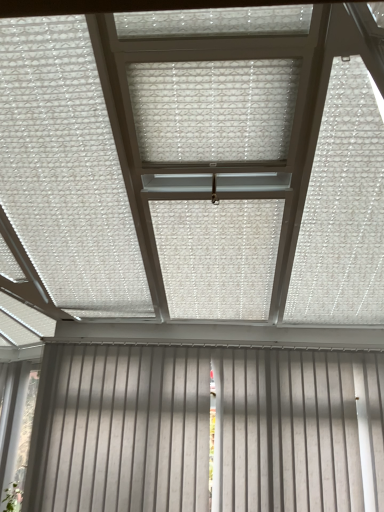
Question: Can you confirm if translucent plastic blind at center is thinner than white matte blinds at lower center?

Choices:
 (A) yes
 (B) no

Answer: (B)

Question: Is translucent plastic blind at center oriented away from white matte blinds at lower center?

Choices:
 (A) yes
 (B) no

Answer: (B)

Question: Is the depth of translucent plastic blind at center less than that of white matte blinds at lower center?

Choices:
 (A) no
 (B) yes

Answer: (B)

Question: Can you confirm if translucent plastic blind at center is smaller than white matte blinds at lower center?

Choices:
 (A) yes
 (B) no

Answer: (A)

Question: From the image's perspective, does translucent plastic blind at center appear higher than white matte blinds at lower center?

Choices:
 (A) no
 (B) yes

Answer: (B)

Question: Is translucent plastic blind at center aimed at white matte blinds at lower center?

Choices:
 (A) no
 (B) yes

Answer: (A)

Question: Considering the relative sizes of white matte blinds at lower center and translucent plastic blind at center in the image provided, is white matte blinds at lower center shorter than translucent plastic blind at center?

Choices:
 (A) no
 (B) yes

Answer: (A)

Question: Is white matte blinds at lower center not within translucent plastic blind at center?

Choices:
 (A) yes
 (B) no

Answer: (A)

Question: Could you tell me if white matte blinds at lower center is facing translucent plastic blind at center?

Choices:
 (A) yes
 (B) no

Answer: (B)

Question: From a real-world perspective, is white matte blinds at lower center over translucent plastic blind at center?

Choices:
 (A) no
 (B) yes

Answer: (A)

Question: Does white matte blinds at lower center have a lesser width compared to translucent plastic blind at center?

Choices:
 (A) yes
 (B) no

Answer: (A)

Question: Are white matte blinds at lower center and translucent plastic blind at center making contact?

Choices:
 (A) yes
 (B) no

Answer: (B)

Question: In the image, is white matte blinds at lower center on the left side or the right side of translucent plastic blind at center?

Choices:
 (A) right
 (B) left

Answer: (A)